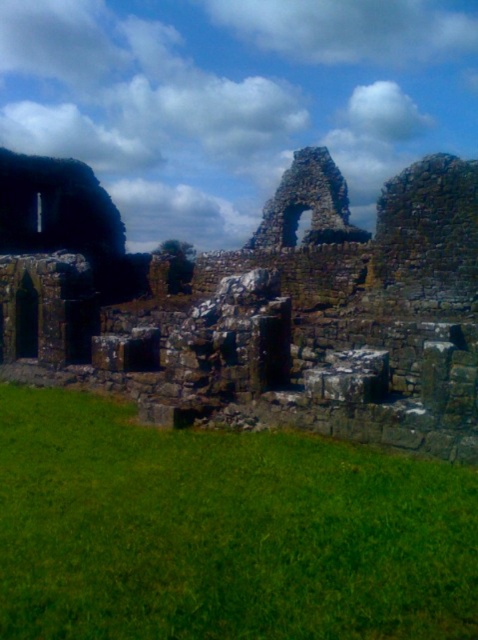
Question: Which of the following is the farthest from the observer?

Choices:
 (A) rusty stone ruins at left
 (B) green grass at lower center

Answer: (A)

Question: Considering the relative positions of green grass at lower center and rusty stone ruins at left in the image provided, where is green grass at lower center located with respect to rusty stone ruins at left?

Choices:
 (A) right
 (B) left

Answer: (B)

Question: Does green grass at lower center appear on the left side of rusty stone ruins at left?

Choices:
 (A) yes
 (B) no

Answer: (A)

Question: Which point appears closest to the camera in this image?

Choices:
 (A) (413, 337)
 (B) (224, 445)

Answer: (B)

Question: Does green grass at lower center appear on the right side of rusty stone ruins at left?

Choices:
 (A) yes
 (B) no

Answer: (B)

Question: Which of the following is the closest to the observer?

Choices:
 (A) (314, 316)
 (B) (201, 433)

Answer: (B)